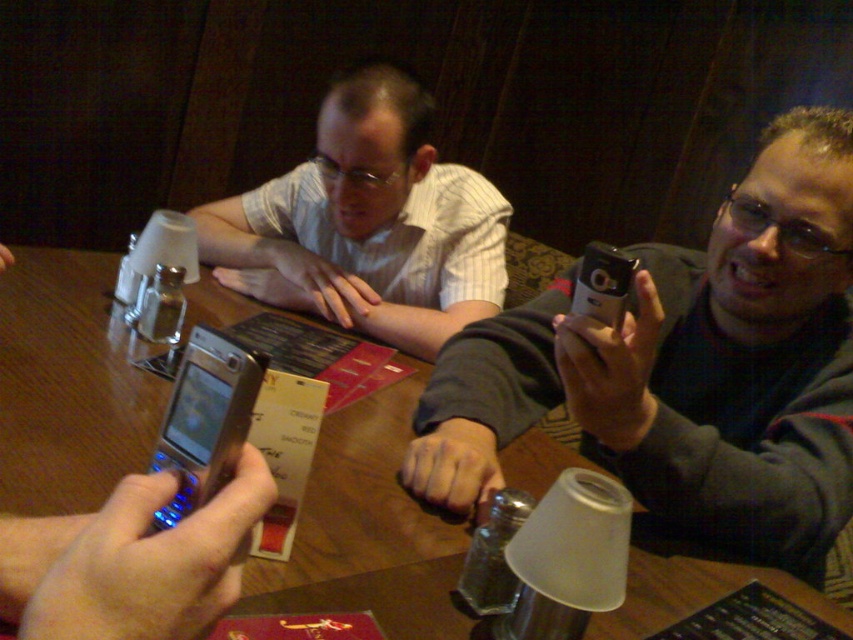
Question: Does white striped shirt at upper center appear under silver metallic phone at lower left?

Choices:
 (A) yes
 (B) no

Answer: (B)

Question: Is silver metallic phone at upper right behind wooden table at center?

Choices:
 (A) yes
 (B) no

Answer: (A)

Question: Among these objects, which one is farthest from the camera?

Choices:
 (A) wooden table at center
 (B) white striped shirt at upper center
 (C) silver metallic phone at upper right
 (D) silver metallic phone at lower left

Answer: (B)

Question: Among these points, which one is nearest to the camera?

Choices:
 (A) (250, 413)
 (B) (834, 164)
 (C) (187, 316)

Answer: (A)

Question: Can you confirm if wooden table at center is bigger than white striped shirt at upper center?

Choices:
 (A) yes
 (B) no

Answer: (A)

Question: Which object is farther from the camera taking this photo?

Choices:
 (A) wooden table at center
 (B) silver metallic phone at upper right
 (C) silver metallic phone at lower left

Answer: (B)